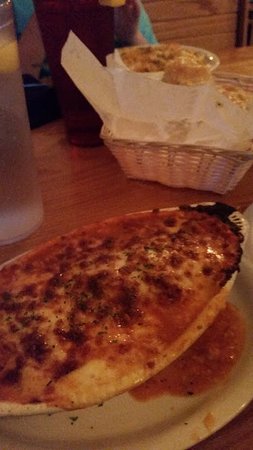
Locate an element on the screen. This screenshot has width=253, height=450. bowl is located at coordinates coord(218,60).